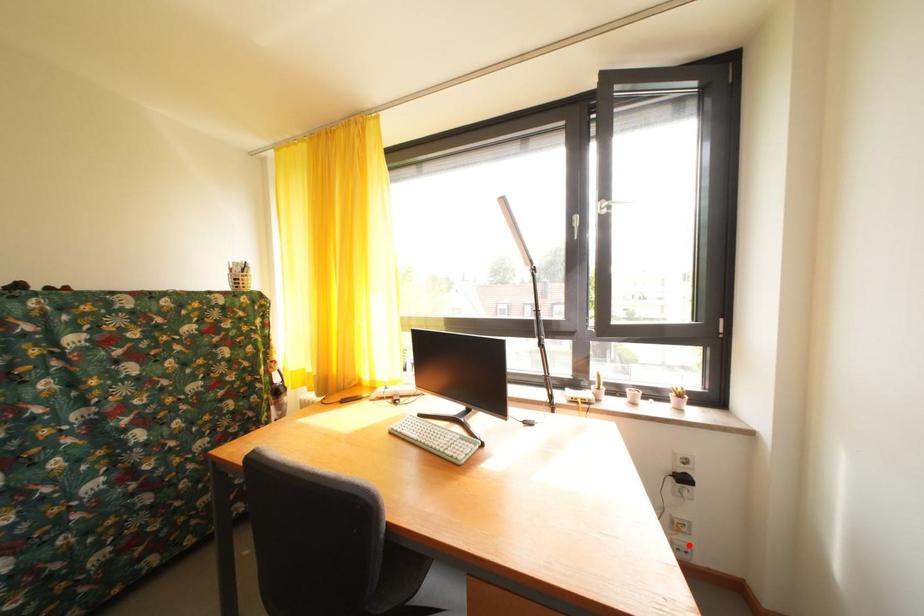
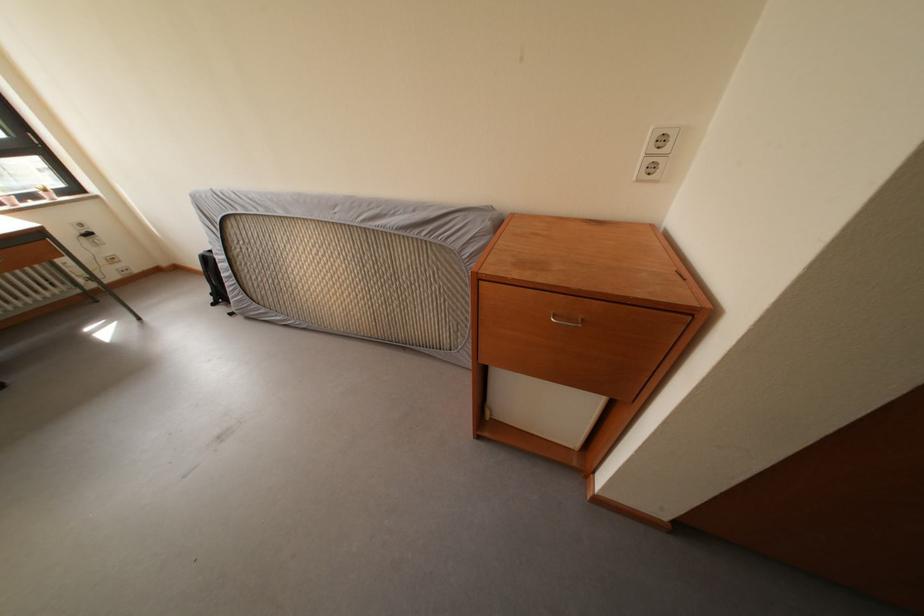
Question: A red point is marked in image1. In image2, is the corresponding 3D point closer to the camera or farther? Reply with the corresponding letter.

Choices:
 (A) The corresponding 3D point is closer.
 (B) The corresponding 3D point is farther.

Answer: (B)